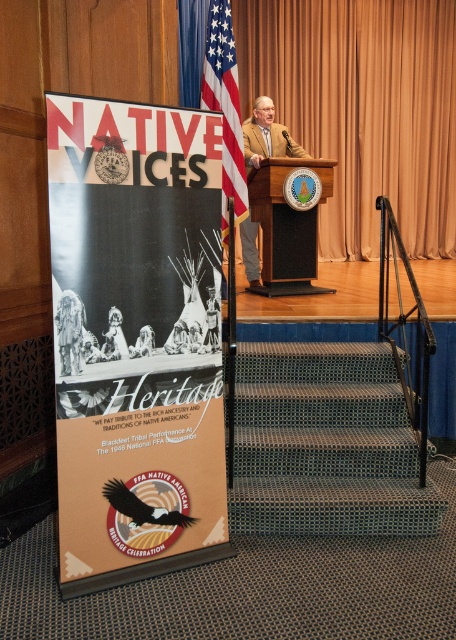
Question: Which point is closer to the camera?

Choices:
 (A) tan leather jacket at center
 (B) american flag at center

Answer: (B)

Question: Is matte cardboard poster at left bigger than blue textured carpet at lower right?

Choices:
 (A) no
 (B) yes

Answer: (A)

Question: Is matte cardboard poster at left to the right of american flag at center from the viewer's perspective?

Choices:
 (A) yes
 (B) no

Answer: (B)

Question: Does matte cardboard poster at left have a greater width compared to tan leather jacket at center?

Choices:
 (A) no
 (B) yes

Answer: (B)

Question: Which object is the farthest from the american flag at center?

Choices:
 (A) blue textured carpet at lower right
 (B) tan leather jacket at center

Answer: (A)

Question: Which of these objects is positioned farthest from the blue textured carpet at lower right?

Choices:
 (A) tan leather jacket at center
 (B) matte cardboard poster at left

Answer: (A)